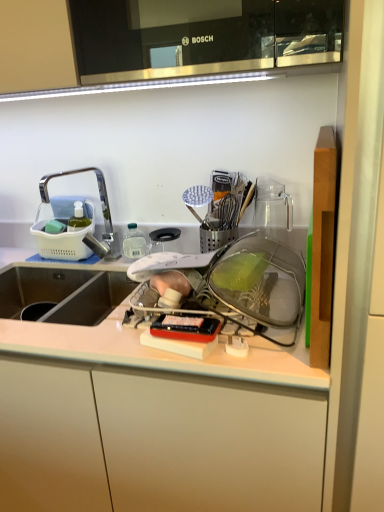
Question: Does white plastic tray at center lie behind white matte cabinet at center?

Choices:
 (A) no
 (B) yes

Answer: (A)

Question: From a real-world perspective, is white plastic tray at center located beneath white matte cabinet at center?

Choices:
 (A) yes
 (B) no

Answer: (B)

Question: Is white plastic tray at center smaller than white matte cabinet at center?

Choices:
 (A) no
 (B) yes

Answer: (B)

Question: Is white plastic tray at center not close to white matte cabinet at center?

Choices:
 (A) no
 (B) yes

Answer: (A)

Question: Considering the relative sizes of white plastic tray at center and white matte cabinet at center in the image provided, is white plastic tray at center wider than white matte cabinet at center?

Choices:
 (A) yes
 (B) no

Answer: (B)

Question: Is white plastic tray at center taller than white matte cabinet at center?

Choices:
 (A) no
 (B) yes

Answer: (A)

Question: Can you confirm if white matte cabinet at center is taller than brushed metal faucet at left?

Choices:
 (A) no
 (B) yes

Answer: (B)

Question: From the image's perspective, is white matte cabinet at center on brushed metal faucet at left?

Choices:
 (A) no
 (B) yes

Answer: (A)

Question: Does white matte cabinet at center have a lesser height compared to brushed metal faucet at left?

Choices:
 (A) yes
 (B) no

Answer: (B)

Question: Considering the relative positions of white matte cabinet at center and brushed metal faucet at left in the image provided, is white matte cabinet at center to the left of brushed metal faucet at left from the viewer's perspective?

Choices:
 (A) yes
 (B) no

Answer: (A)

Question: From a real-world perspective, is white matte cabinet at center below brushed metal faucet at left?

Choices:
 (A) yes
 (B) no

Answer: (A)

Question: From a real-world perspective, is white matte cabinet at center on brushed metal faucet at left?

Choices:
 (A) yes
 (B) no

Answer: (B)

Question: Does brushed metal faucet at left have a greater width compared to white plastic tray at center?

Choices:
 (A) yes
 (B) no

Answer: (B)